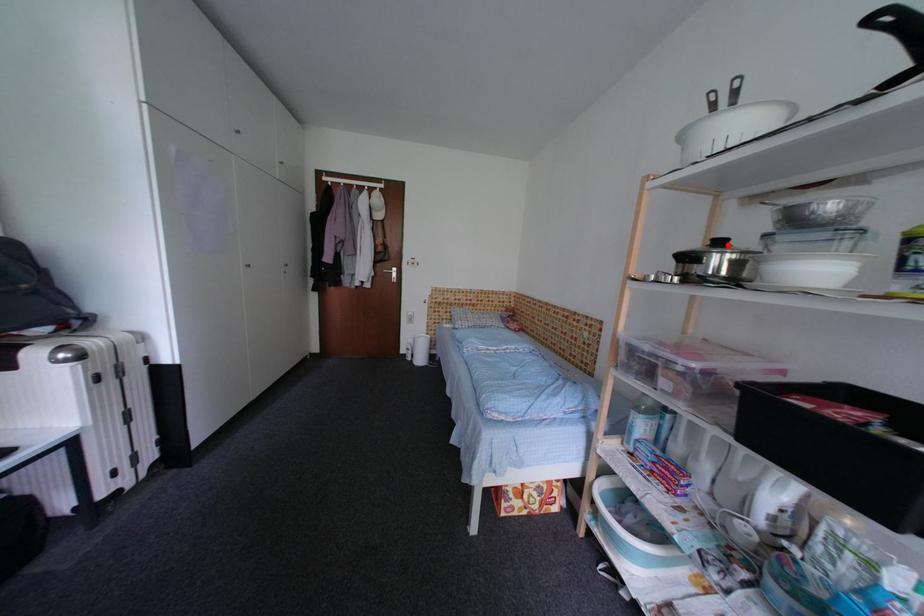
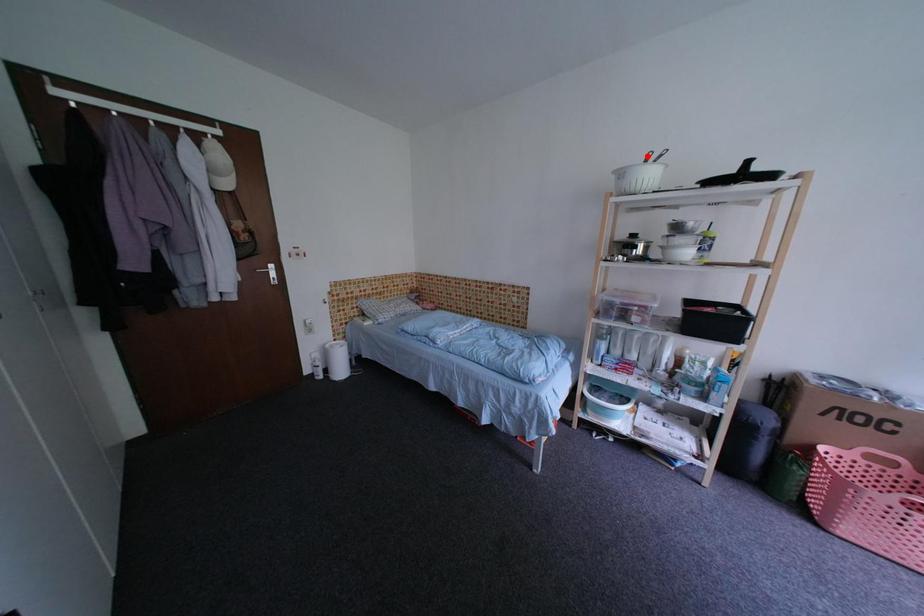
I am providing you with two images of the same scene from different viewpoints. A red point is marked on the first image and another point is marked on the second image. Does the point marked in image1 correspond to the same location as the one in image2?

No